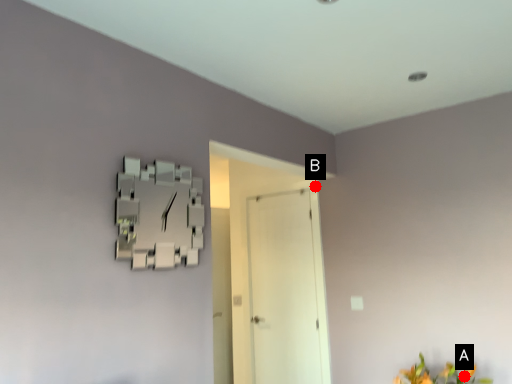
Question: Two points are circled on the image, labeled by A and B beside each circle. Which point is farther to the camera?

Choices:
 (A) A is further
 (B) B is further

Answer: (B)